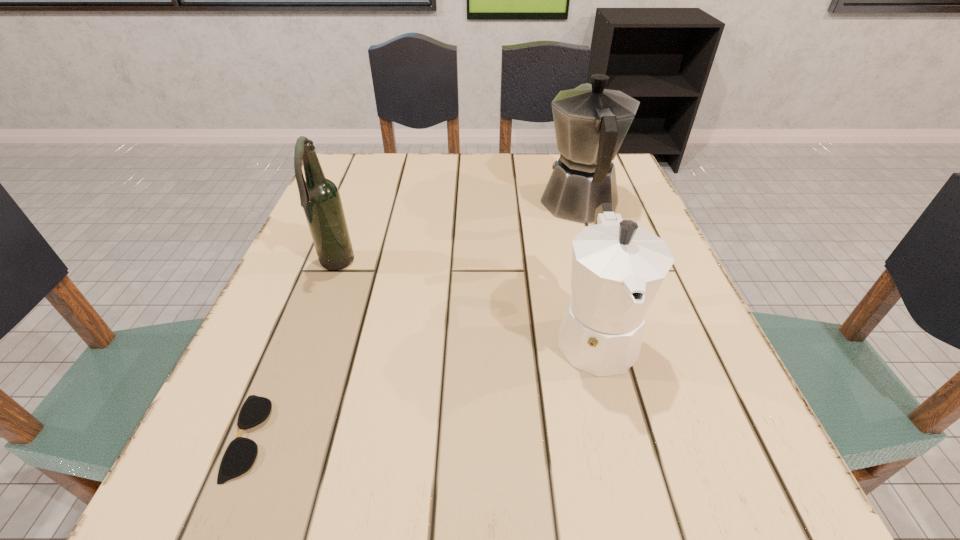
Locate an element on the screen. The width and height of the screenshot is (960, 540). the farthest object is located at coordinates (591, 122).

This screenshot has height=540, width=960. Find the location of `the taller coffeepot`. the taller coffeepot is located at coordinates (591, 122).

Identify the location of beer bottle. (320, 198).

The width and height of the screenshot is (960, 540). What are the coordinates of `the shorter coffeepot` in the screenshot? It's located at (618, 267).

The image size is (960, 540). Find the location of `the second nearest object`. the second nearest object is located at coordinates (618, 267).

Identify the location of the nearest object. This screenshot has width=960, height=540. (240, 455).

You are a GUI agent. You are given a task and a screenshot of the screen. Output one action in this format:
    pyautogui.click(x=<x>, y=<y>)
    Task: Click on the shortest object
    This screenshot has width=960, height=540.
    Given the screenshot: What is the action you would take?
    tap(240, 455)

This screenshot has height=540, width=960. In order to click on vacant space situated at the spout of the farther coffeepot in this screenshot , I will do `click(565, 157)`.

You are a GUI agent. You are given a task and a screenshot of the screen. Output one action in this format:
    pyautogui.click(x=<x>, y=<y>)
    Task: Click on the free space located at the spout of the farther coffeepot
    This screenshot has height=540, width=960.
    Given the screenshot: What is the action you would take?
    pyautogui.click(x=567, y=164)

Locate an element on the screen. Image resolution: width=960 pixels, height=540 pixels. free spot located 0.060m at the spout of the farther coffeepot is located at coordinates (568, 166).